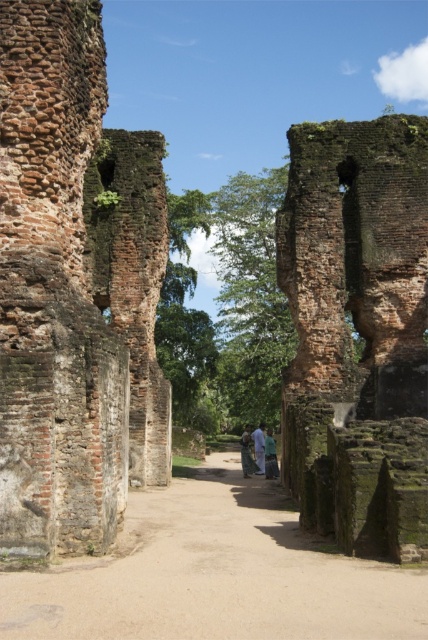
Who is more forward, (89, 220) or (252, 435)?

Positioned in front is point (89, 220).

Does point (55, 524) come in front of point (253, 440)?

Yes, point (55, 524) is closer to viewer.

Find the location of a particular element. This screenshot has height=640, width=428. rusty brick ruins at left is located at coordinates (74, 289).

Can you confirm if brown dirt path at center is positioned to the right of green fabric pants at center?

No, brown dirt path at center is not to the right of green fabric pants at center.

Can you confirm if brown dirt path at center is thinner than green fabric pants at center?

In fact, brown dirt path at center might be wider than green fabric pants at center.

Which is in front, point (64, 609) or point (270, 460)?

Point (64, 609) is more forward.

Locate an element on the screen. This screenshot has width=428, height=640. brown dirt path at center is located at coordinates (214, 573).

Is rusty brick ruins at left closer to camera compared to green fabric dress at center?

Yes, it is in front of green fabric dress at center.

This screenshot has width=428, height=640. What are the coordinates of `rusty brick ruins at left` in the screenshot? It's located at (74, 289).

This screenshot has height=640, width=428. Describe the element at coordinates (74, 289) in the screenshot. I see `rusty brick ruins at left` at that location.

Locate an element on the screen. This screenshot has width=428, height=640. rusty brick ruins at left is located at coordinates (74, 289).